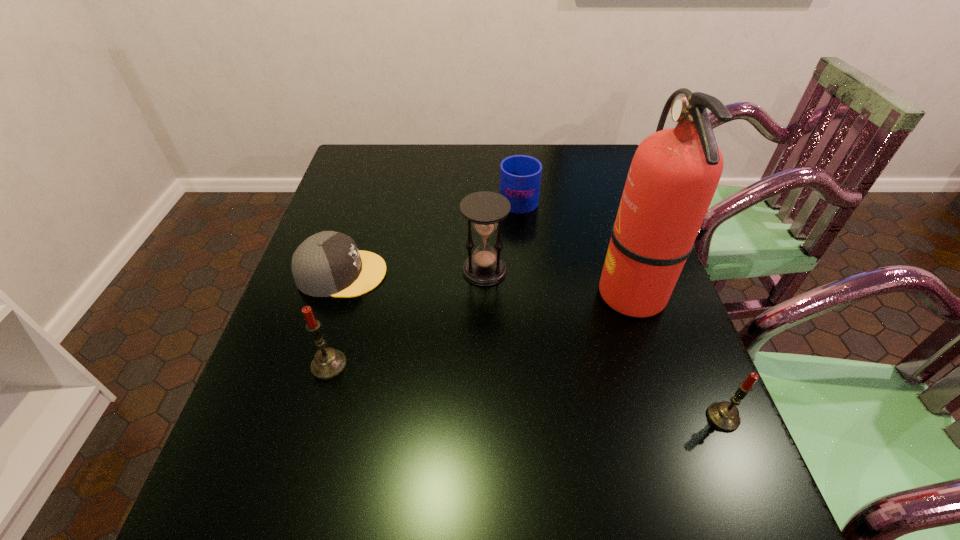
To achieve uniform spacing by inserting another candle among them, please point to a free space for this new candle. Please provide its 2D coordinates. Your answer should be formatted as a tuple, i.e. [(x, y)], where the tuple contains the x and y coordinates of a point satisfying the conditions above.

[(517, 390)]